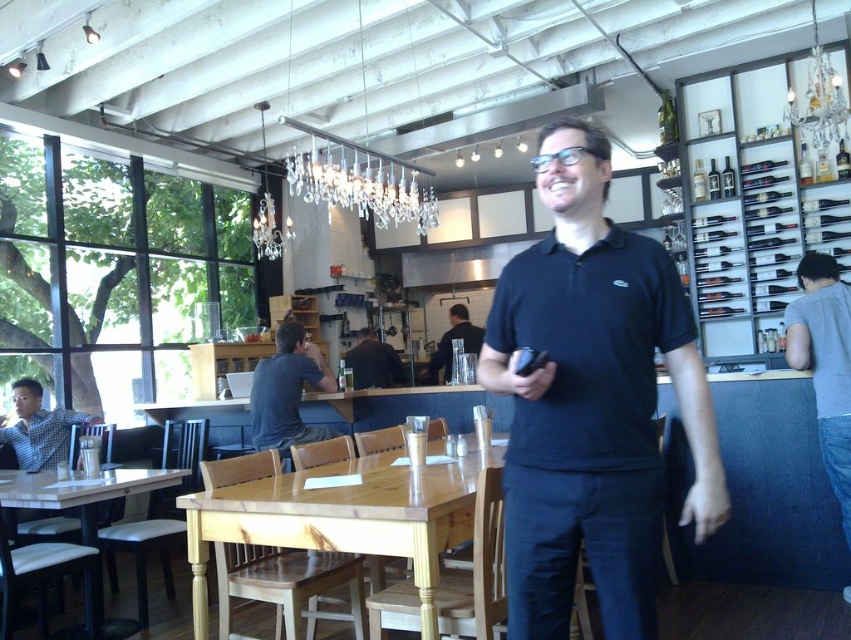
Can you confirm if wooden table at lower left is positioned above matte black shirt at center?

No.

Between wooden table at lower left and matte black shirt at center, which one has more height?

Standing taller between the two is wooden table at lower left.

Locate an element on the screen. The width and height of the screenshot is (851, 640). wooden table at lower left is located at coordinates (80, 492).

Find the location of a particular element. wooden table at lower left is located at coordinates click(x=80, y=492).

Image resolution: width=851 pixels, height=640 pixels. In order to click on wooden table at lower left in this screenshot , I will do `click(80, 492)`.

Does wooden table at lower left have a lesser width compared to dark gray shirt at center?

No, wooden table at lower left is not thinner than dark gray shirt at center.

Where is `wooden table at lower left`? wooden table at lower left is located at coordinates (80, 492).

At what (x,y) coordinates should I click in order to perform the action: click on wooden table at lower left. Please return your answer as a coordinate pair (x, y). The height and width of the screenshot is (640, 851). Looking at the image, I should click on (80, 492).

Between checkered fabric shirt at left and matte black shirt at center, which one has less height?

With less height is checkered fabric shirt at left.

Is point (10, 429) less distant than point (450, 310)?

Yes, point (10, 429) is closer to viewer.

Identify the location of checkered fabric shirt at left. (38, 428).